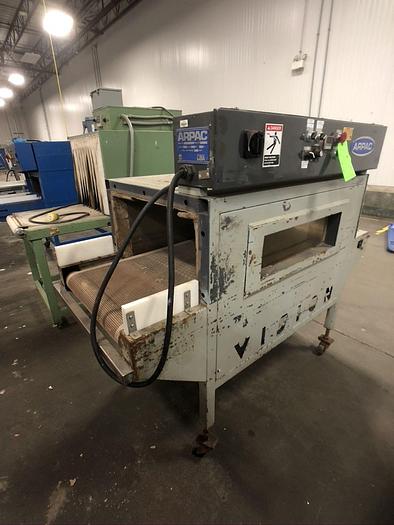
Where is `floor`? This screenshot has width=394, height=525. floor is located at coordinates 289,438.